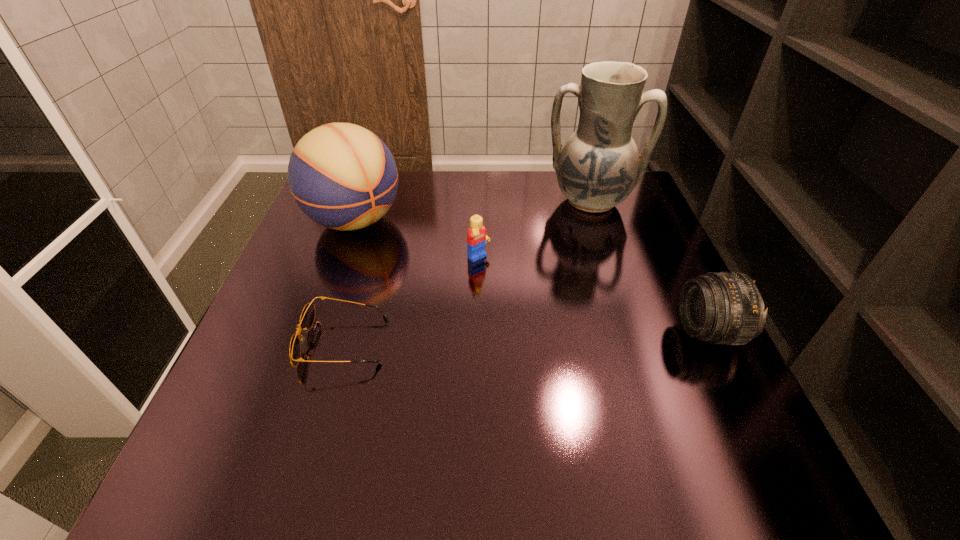
At what (x,y) coordinates should I click in order to perform the action: click on free spot on the desktop that is between the sunglasses and the telephoto lens and is positioned on the face of the third object from left to right. Please return your answer as a coordinate pair (x, y). Image resolution: width=960 pixels, height=540 pixels. Looking at the image, I should click on (565, 336).

Where is `vacant space on the desktop that is between the shortest object and the telephoto lens and is positioned on the patterned surface of the fourth shortest object`? The image size is (960, 540). vacant space on the desktop that is between the shortest object and the telephoto lens and is positioned on the patterned surface of the fourth shortest object is located at coordinates (491, 339).

What are the coordinates of `free spot on the desktop that is between the shortest object and the third tallest object and is positioned on the front-facing side of the tallest object` in the screenshot? It's located at (574, 336).